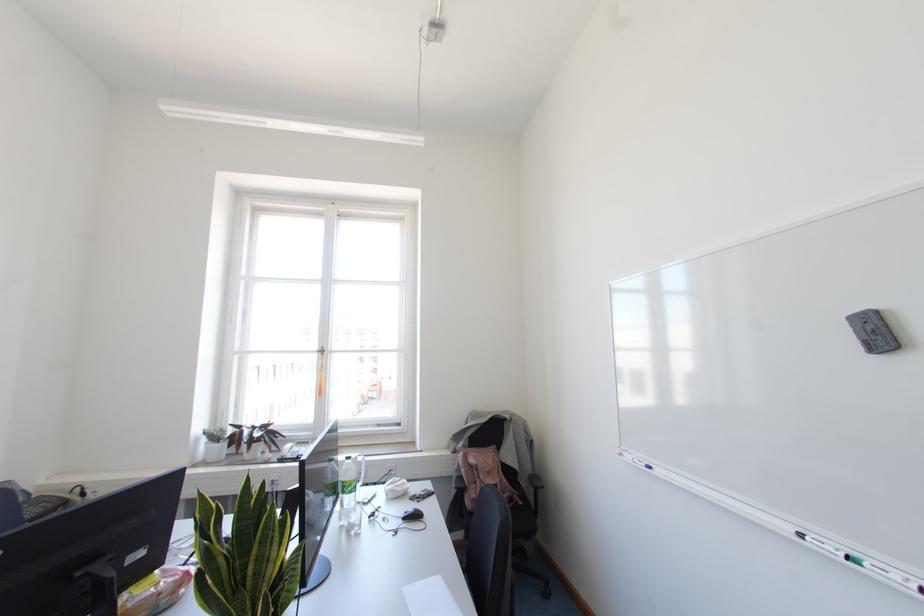
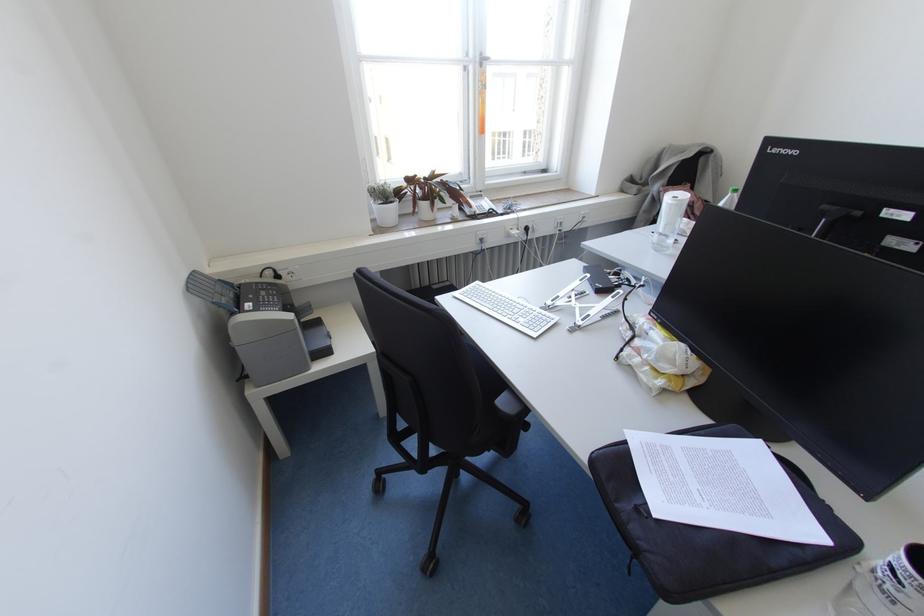
In the second image, find the point that corresponds to pixel 299 455 in the first image.

(490, 209)